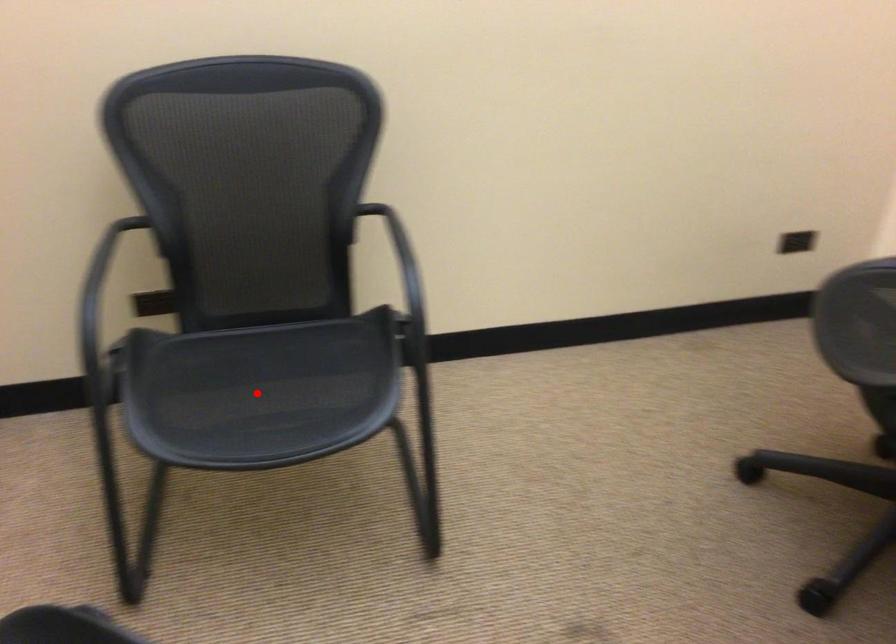
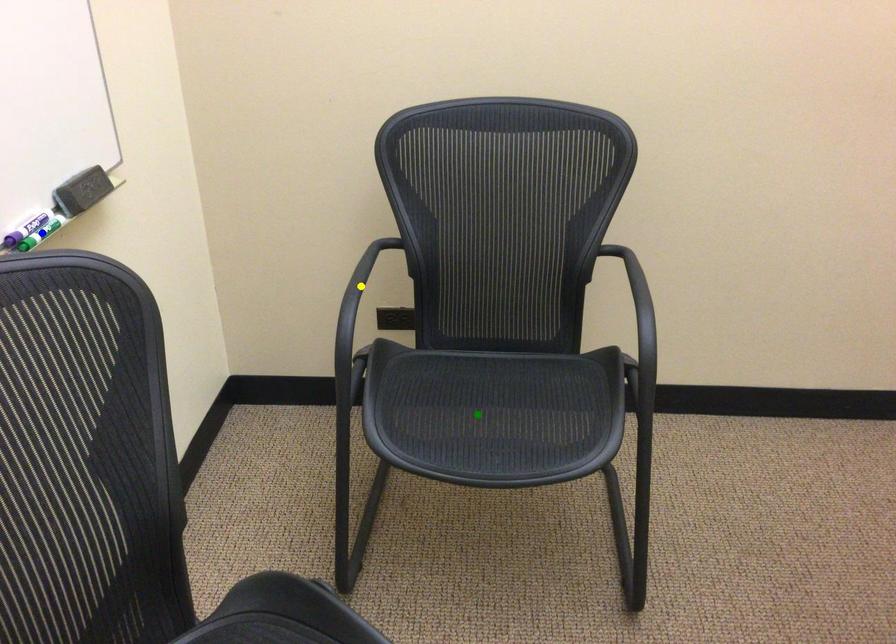
Question: I am providing you with two images of the same scene from different viewpoints. A red point is marked on the first image. You are given multiple points on the second image. Can you choose the point in image 2 that corresponds to the point in image 1?

Choices:
 (A) green point
 (B) blue point
 (C) yellow point

Answer: (A)